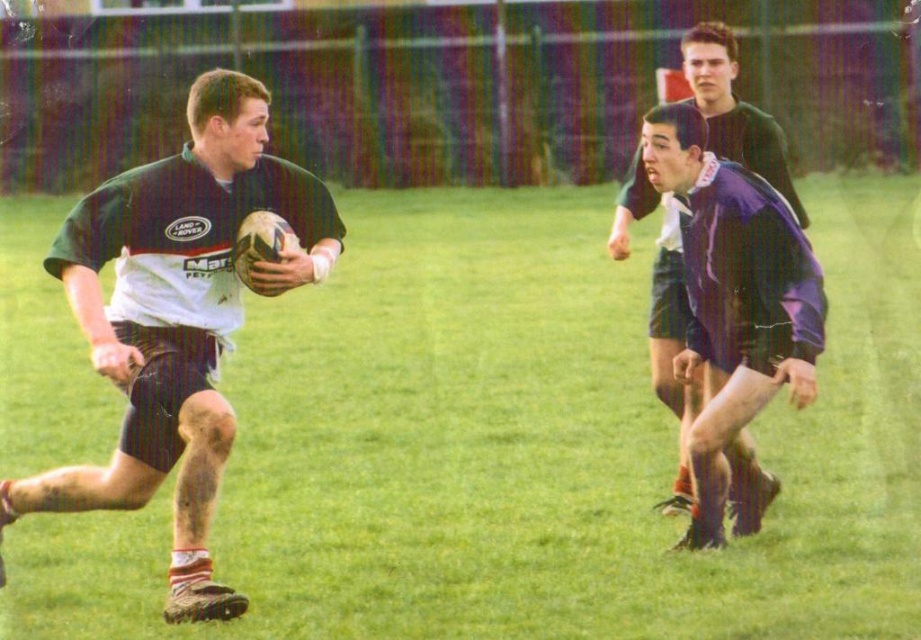
Question: Among these objects, which one is nearest to the camera?

Choices:
 (A) purple fabric shorts at right
 (B) matte green rugby ball at left

Answer: (B)

Question: Is matte green rugby ball at left bigger than purple fabric shorts at right?

Choices:
 (A) yes
 (B) no

Answer: (A)

Question: Can you confirm if matte green rugby ball at left is positioned below purple fabric shorts at right?

Choices:
 (A) no
 (B) yes

Answer: (B)

Question: Is matte green rugby ball at left above purple fabric shorts at right?

Choices:
 (A) yes
 (B) no

Answer: (B)

Question: Among these points, which one is farthest from the camera?

Choices:
 (A) (680, 432)
 (B) (299, 216)

Answer: (A)